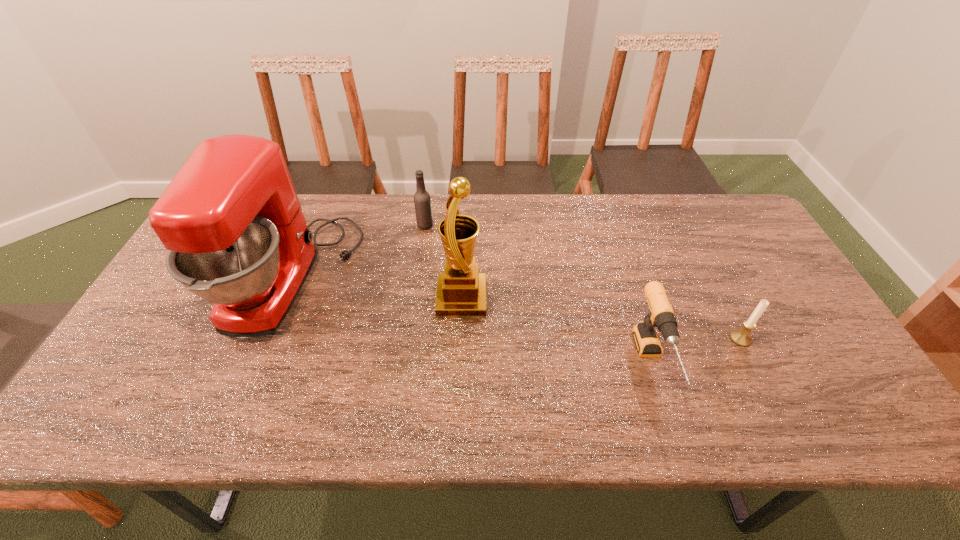
Image resolution: width=960 pixels, height=540 pixels. I want to click on kitchen mixer, so click(237, 237).

Locate an element on the screen. The height and width of the screenshot is (540, 960). the third object from right to left is located at coordinates (461, 291).

This screenshot has width=960, height=540. Find the location of `beer bottle`. beer bottle is located at coordinates (422, 201).

What are the coordinates of `the third shortest object` in the screenshot? It's located at (422, 201).

Image resolution: width=960 pixels, height=540 pixels. In order to click on the fourth object from left to right in this screenshot , I will do `click(661, 315)`.

Where is `candle holder`? This screenshot has height=540, width=960. candle holder is located at coordinates (741, 337).

This screenshot has height=540, width=960. Identify the location of vacant space located 0.360m on the front-facing side of the kitchen mixer. (480, 279).

You are a GUI agent. You are given a task and a screenshot of the screen. Output one action in this format:
    pyautogui.click(x=<x>, y=<y>)
    Task: Click on the free location located 0.160m on the front-facing side of the third object from right to left
    The height and width of the screenshot is (540, 960).
    Given the screenshot: What is the action you would take?
    pyautogui.click(x=544, y=298)

Find the location of a particular element. This screenshot has width=960, height=540. free space located 0.230m on the label of the fourth object from right to left is located at coordinates (504, 225).

Where is `vacant space situated 0.080m on the right of the candle holder`? The height and width of the screenshot is (540, 960). vacant space situated 0.080m on the right of the candle holder is located at coordinates (781, 339).